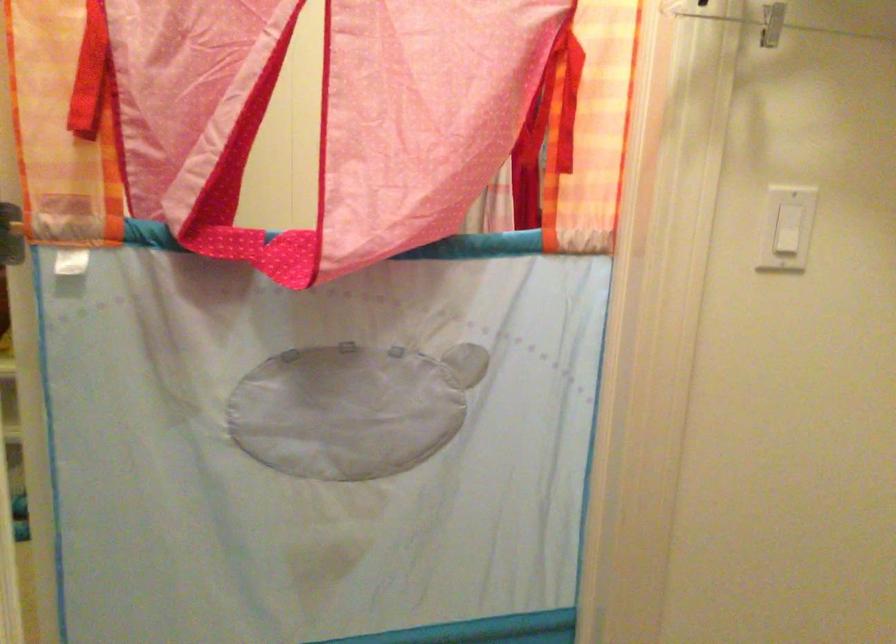
At what (x,y) coordinates should I click in order to perform the action: click on fabric door tab. Please return your answer as a coordinate pair (x, y). The width and height of the screenshot is (896, 644). Looking at the image, I should click on (351, 408).